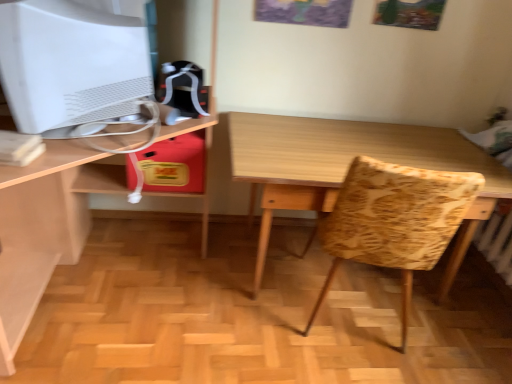
You are a GUI agent. You are given a task and a screenshot of the screen. Output one action in this format:
    pyautogui.click(x=<x>, y=<y>)
    Task: Click on the vacant space in between wooden table at center and patterned fabric swivel chair at center
    Image resolution: width=512 pixels, height=384 pixels.
    Given the screenshot: What is the action you would take?
    pyautogui.click(x=377, y=332)